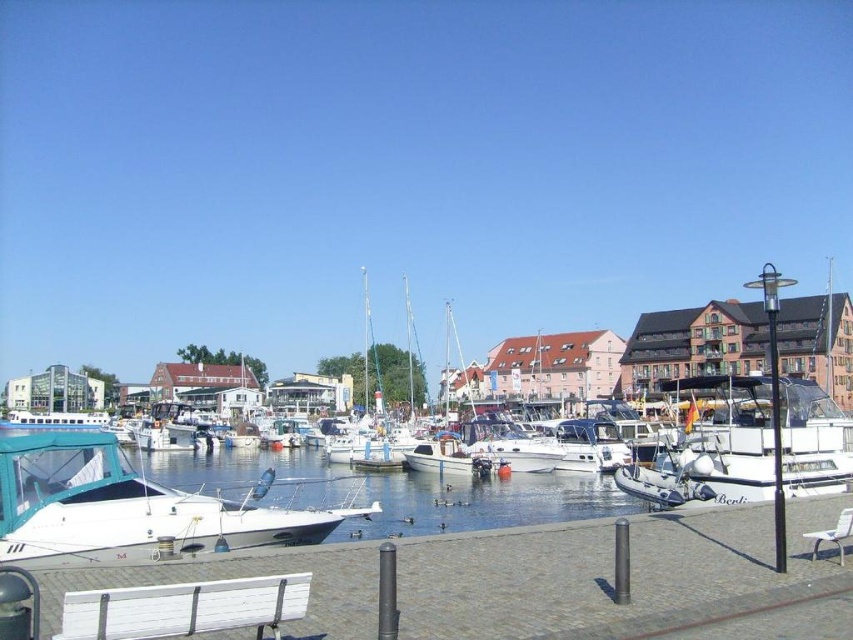
The height and width of the screenshot is (640, 853). What do you see at coordinates (126, 508) in the screenshot?
I see `teal matte sailboat at lower left` at bounding box center [126, 508].

Which is above, teal matte sailboat at lower left or white plastic park bench at lower right?

white plastic park bench at lower right

Who is more forward, (74, 449) or (840, 520)?

Positioned in front is point (840, 520).

The image size is (853, 640). Identify the location of teal matte sailboat at lower left. (126, 508).

Between white matte water at center and white matte boat at center, which one appears on the right side from the viewer's perspective?

Positioned to the right is white matte boat at center.

Does white matte water at center have a larger size compared to white matte boat at center?

Actually, white matte water at center might be smaller than white matte boat at center.

The width and height of the screenshot is (853, 640). I want to click on white matte water at center, so click(x=389, y=492).

From the picture: Is white matte sailboat at center taller than white plastic park bench at lower right?

Yes, white matte sailboat at center is taller than white plastic park bench at lower right.

Can you confirm if white matte sailboat at center is smaller than white plastic park bench at lower right?

No, white matte sailboat at center is not smaller than white plastic park bench at lower right.

Identify the location of white matte sailboat at center. (448, 433).